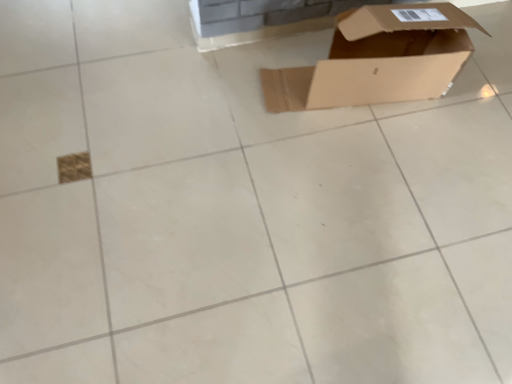
You are a GUI agent. You are given a task and a screenshot of the screen. Output one action in this format:
    pyautogui.click(x=<x>, y=<y>)
    Task: Click on the vacant region to the right of brown cardboard box at upper right
    This screenshot has width=512, height=384.
    Given the screenshot: What is the action you would take?
    pyautogui.click(x=473, y=105)